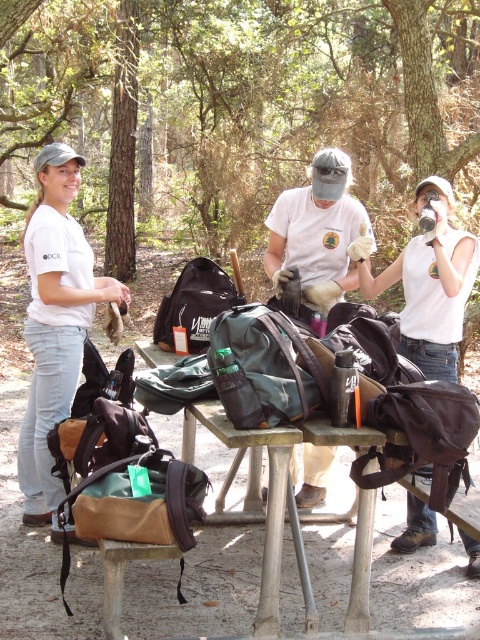
Is metallic silver table at center to the right of matte black backpack at center from the viewer's perspective?

Correct, you'll find metallic silver table at center to the right of matte black backpack at center.

Measure the distance from metallic silver table at center to matte black backpack at center.

They are 2.15 meters apart.

Is point (322, 438) positioned before point (202, 337)?

Yes, it is in front of point (202, 337).

Image resolution: width=480 pixels, height=640 pixels. In order to click on metallic silver table at center in this screenshot , I will do `click(232, 460)`.

From the picture: Which of these two, metallic silver table at center or green fabric backpack at center, stands shorter?

metallic silver table at center is shorter.

Is metallic silver table at center positioned at the back of green fabric backpack at center?

Yes, it is behind green fabric backpack at center.

Which is in front, point (417, 582) or point (225, 380)?

Positioned in front is point (225, 380).

What are the coordinates of `metallic silver table at center` in the screenshot? It's located at (232, 460).

Does point (36, 292) come closer to viewer compared to point (333, 214)?

Yes, it is in front of point (333, 214).

Can you confirm if matte white t-shirt at left is thinner than white matte t-shirt at center?

Incorrect, matte white t-shirt at left's width is not less than white matte t-shirt at center's.

The width and height of the screenshot is (480, 640). I want to click on matte white t-shirt at left, so click(x=55, y=323).